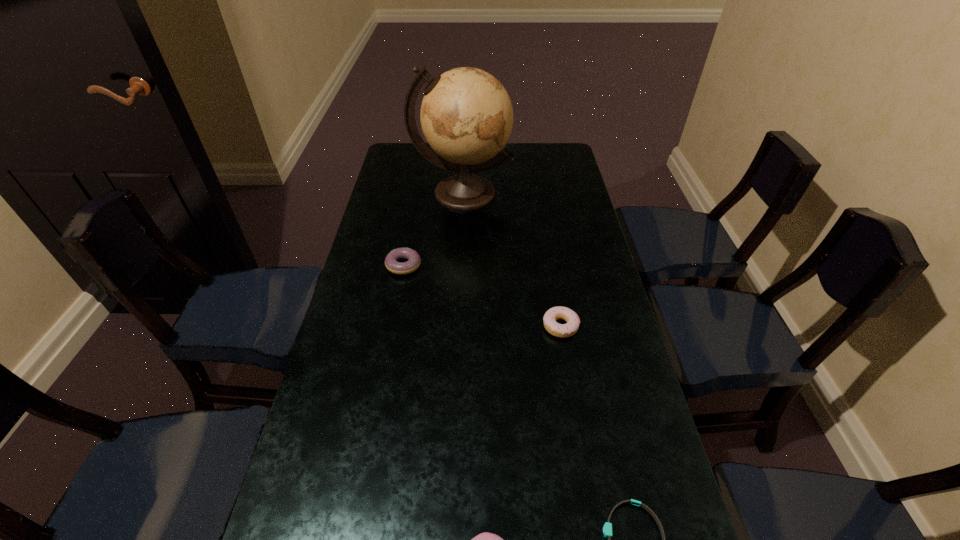
I want to click on object that can be found as the second closest to the shortest object, so pos(571,327).

What are the coordinates of `doughnut that is the second closest to the second farthest doughnut` in the screenshot? It's located at (485, 539).

Identify the location of doughnut that stands as the second closest to the wristband. (571, 327).